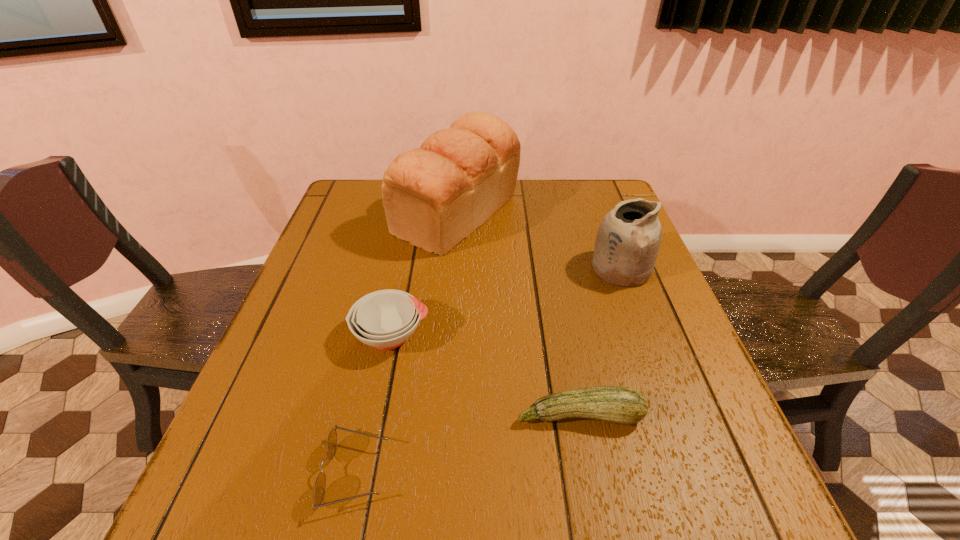
Where is `the tallest object`? the tallest object is located at coordinates (434, 196).

The image size is (960, 540). I want to click on pottery, so click(627, 243).

The height and width of the screenshot is (540, 960). Identify the location of the third nearest object. (385, 319).

This screenshot has width=960, height=540. What are the coordinates of `zucchini` in the screenshot? It's located at (619, 404).

I want to click on the shortest object, so click(319, 490).

The image size is (960, 540). I want to click on spectacles, so click(319, 490).

This screenshot has width=960, height=540. What are the coordinates of `vacant position located on the left of the tallest object` in the screenshot? It's located at pos(359,214).

The width and height of the screenshot is (960, 540). Find the location of `free space located on the front of the pottery`. free space located on the front of the pottery is located at coordinates (657, 363).

Locate an element on the screen. free region located 0.290m on the back of the soup bowl is located at coordinates (411, 236).

Locate an element on the screen. free region located at the stem end of the zucchini is located at coordinates (592, 483).